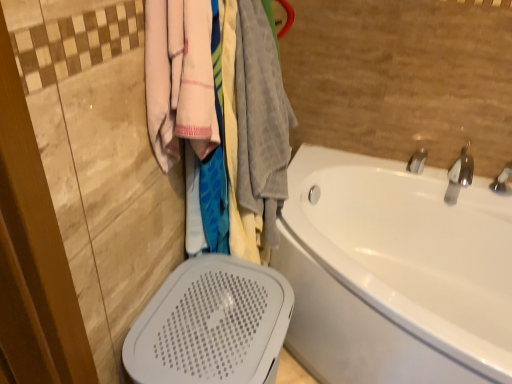
What is the approximate height of white glossy bathtub at right?

23.63 inches.

This screenshot has height=384, width=512. Describe the element at coordinates (179, 78) in the screenshot. I see `soft pink towel at upper left` at that location.

Identify the location of soft pink towel at upper left. (179, 78).

This screenshot has height=384, width=512. What do you see at coordinates (417, 161) in the screenshot? I see `silver metallic tap at upper right, which is the 2th tap from right to left` at bounding box center [417, 161].

Locate an element on the screen. This screenshot has width=512, height=384. white glossy bathtub at right is located at coordinates (395, 273).

Between soft cotton towels at upper left and silver metallic tap at upper right, which is counted as the 1th tap, starting from the left, which one appears on the left side from the viewer's perspective?

soft cotton towels at upper left is more to the left.

This screenshot has width=512, height=384. What are the coordinates of `closet in front of the silver metallic tap at upper right, which is the 2th tap from right to left` in the screenshot? It's located at (221, 118).

Relative to silver metallic tap at upper right, which is counted as the 1th tap, starting from the left, is soft cotton towels at upper left in front or behind?

soft cotton towels at upper left is in front of silver metallic tap at upper right, which is counted as the 1th tap, starting from the left.

In the scene shown: Is soft cotton towels at upper left taller than silver metallic tap at upper right, which is the 2th tap from right to left?

Yes, soft cotton towels at upper left is taller than silver metallic tap at upper right, which is the 2th tap from right to left.

Would you say white glossy bathtub at right contains soft cotton towels at upper left?

No, soft cotton towels at upper left is located outside of white glossy bathtub at right.

Is white glossy bathtub at right shorter than soft cotton towels at upper left?

Correct, white glossy bathtub at right is not as tall as soft cotton towels at upper left.

Does point (344, 356) come behind point (204, 176)?

Yes, it is.

Is white glossy bathtub at right aimed at soft cotton towels at upper left?

No, white glossy bathtub at right is not oriented towards soft cotton towels at upper left.

In terms of width, does silver metallic faucet at upper right, which ranks as the 1th tap in right-to-left order, look wider or thinner when compared to white glossy bathtub at right?

Considering their sizes, silver metallic faucet at upper right, which ranks as the 1th tap in right-to-left order, looks slimmer than white glossy bathtub at right.

Find the location of a particular element. The height and width of the screenshot is (384, 512). bathtub on the left side of silver metallic faucet at upper right, acting as the second tap starting from the left is located at coordinates (395, 273).

Can you confirm if silver metallic faucet at upper right, which ranks as the 1th tap in right-to-left order, is positioned to the left of white glossy bathtub at right?

Incorrect, silver metallic faucet at upper right, which ranks as the 1th tap in right-to-left order, is not on the left side of white glossy bathtub at right.

Is the surface of silver metallic faucet at upper right, which ranks as the 1th tap in right-to-left order, in direct contact with soft pink towel at upper left?

No, silver metallic faucet at upper right, which ranks as the 1th tap in right-to-left order, is not with soft pink towel at upper left.

From a real-world perspective, who is located lower, silver metallic faucet at upper right, acting as the second tap starting from the left, or soft pink towel at upper left?

silver metallic faucet at upper right, acting as the second tap starting from the left.

Could you measure the distance between silver metallic faucet at upper right, which ranks as the 1th tap in right-to-left order, and soft pink towel at upper left?

The distance of silver metallic faucet at upper right, which ranks as the 1th tap in right-to-left order, from soft pink towel at upper left is 3.91 feet.

Consider the image. Considering the relative sizes of silver metallic faucet at upper right, which ranks as the 1th tap in right-to-left order, and soft pink towel at upper left in the image provided, is silver metallic faucet at upper right, which ranks as the 1th tap in right-to-left order, taller than soft pink towel at upper left?

In fact, silver metallic faucet at upper right, which ranks as the 1th tap in right-to-left order, may be shorter than soft pink towel at upper left.

Consider the image. Does soft pink towel at upper left turn towards silver metallic faucet at upper right, acting as the second tap starting from the left?

No, soft pink towel at upper left is not aimed at silver metallic faucet at upper right, acting as the second tap starting from the left.

Considering the sizes of objects soft pink towel at upper left and silver metallic faucet at upper right, acting as the second tap starting from the left, in the image provided, who is smaller, soft pink towel at upper left or silver metallic faucet at upper right, acting as the second tap starting from the left,?

Smaller between the two is silver metallic faucet at upper right, acting as the second tap starting from the left.

From the image's perspective, which one is positioned higher, soft pink towel at upper left or silver metallic faucet at upper right, which ranks as the 1th tap in right-to-left order?

soft pink towel at upper left.

Which point is more forward, [152,85] or [457,172]?

Point [152,85]

Between silver metallic tap at upper right, which is counted as the 1th tap, starting from the left, and white glossy bathtub at right, which one has smaller width?

silver metallic tap at upper right, which is counted as the 1th tap, starting from the left, is thinner.

Who is shorter, silver metallic tap at upper right, which is counted as the 1th tap, starting from the left, or white glossy bathtub at right?

Standing shorter between the two is silver metallic tap at upper right, which is counted as the 1th tap, starting from the left.

Locate an element on the screen. The width and height of the screenshot is (512, 384). bathtub in front of the silver metallic tap at upper right, which is the 2th tap from right to left is located at coordinates (395, 273).

Would you say silver metallic tap at upper right, which is the 2th tap from right to left, is inside or outside soft cotton towels at upper left?

silver metallic tap at upper right, which is the 2th tap from right to left, is not enclosed by soft cotton towels at upper left.

Considering the sizes of objects silver metallic tap at upper right, which is the 2th tap from right to left, and soft cotton towels at upper left in the image provided, who is thinner, silver metallic tap at upper right, which is the 2th tap from right to left, or soft cotton towels at upper left?

silver metallic tap at upper right, which is the 2th tap from right to left, is thinner.

From the image's perspective, is silver metallic tap at upper right, which is counted as the 1th tap, starting from the left, above or below soft cotton towels at upper left?

silver metallic tap at upper right, which is counted as the 1th tap, starting from the left, is below soft cotton towels at upper left.

At what (x,y) coordinates should I click in order to perform the action: click on closet that is above the silver metallic tap at upper right, which is counted as the 1th tap, starting from the left (from a real-world perspective). Please return your answer as a coordinate pair (x, y). The height and width of the screenshot is (384, 512). Looking at the image, I should click on (221, 118).

You are a GUI agent. You are given a task and a screenshot of the screen. Output one action in this format:
    pyautogui.click(x=<x>, y=<y>)
    Task: Click on the closet in front of the white glossy bathtub at right
    
    Given the screenshot: What is the action you would take?
    pyautogui.click(x=221, y=118)

Looking at the image, which one is located closer to white glossy bathtub at right, silver metallic faucet at upper right, acting as the second tap starting from the left, or silver metallic tap at upper right, which is counted as the 1th tap, starting from the left?

silver metallic faucet at upper right, acting as the second tap starting from the left, is positioned closer to the anchor white glossy bathtub at right.

Considering their positions, is soft cotton towels at upper left positioned closer to soft pink towel at upper left than white glossy bathtub at right?

Based on the image, soft cotton towels at upper left appears to be nearer to soft pink towel at upper left.

When comparing their distances from silver metallic tap at upper right, which is counted as the 1th tap, starting from the left, does soft cotton towels at upper left or white glossy bathtub at right seem closer?

white glossy bathtub at right lies closer to silver metallic tap at upper right, which is counted as the 1th tap, starting from the left, than the other object.

Looking at the image, which one is located further to white glossy bathtub at right, silver metallic tap at upper right, which is the 2th tap from right to left, or soft pink towel at upper left?

Among the two, soft pink towel at upper left is located further to white glossy bathtub at right.

Considering their positions, is soft cotton towels at upper left positioned closer to silver metallic tap at upper right, which is counted as the 1th tap, starting from the left, than soft pink towel at upper left?

The object closer to silver metallic tap at upper right, which is counted as the 1th tap, starting from the left, is soft cotton towels at upper left.

Based on their spatial positions, is silver metallic faucet at upper right, acting as the second tap starting from the left, or white glossy bathtub at right closer to soft cotton towels at upper left?

Among the two, white glossy bathtub at right is located nearer to soft cotton towels at upper left.

When comparing their distances from silver metallic faucet at upper right, acting as the second tap starting from the left, does silver metallic tap at upper right, which is counted as the 1th tap, starting from the left, or soft pink towel at upper left seem closer?

Based on the image, silver metallic tap at upper right, which is counted as the 1th tap, starting from the left, appears to be nearer to silver metallic faucet at upper right, acting as the second tap starting from the left.

From the image, which object appears to be nearer to silver metallic tap at upper right, which is counted as the 1th tap, starting from the left, white glossy bathtub at right or silver metallic faucet at upper right, which ranks as the 1th tap in right-to-left order?

silver metallic faucet at upper right, which ranks as the 1th tap in right-to-left order, lies closer to silver metallic tap at upper right, which is counted as the 1th tap, starting from the left, than the other object.

This screenshot has height=384, width=512. Find the location of `closet between soft pink towel at upper left and silver metallic faucet at upper right, which ranks as the 1th tap in right-to-left order, from left to right`. closet between soft pink towel at upper left and silver metallic faucet at upper right, which ranks as the 1th tap in right-to-left order, from left to right is located at coordinates 221,118.

Identify the location of bathtub located between soft cotton towels at upper left and silver metallic faucet at upper right, acting as the second tap starting from the left, in the left-right direction. The height and width of the screenshot is (384, 512). (395, 273).

You are a GUI agent. You are given a task and a screenshot of the screen. Output one action in this format:
    pyautogui.click(x=<x>, y=<y>)
    Task: Click on the closet between soft pink towel at upper left and silver metallic tap at upper right, which is the 2th tap from right to left, in the front-back direction
    This screenshot has height=384, width=512.
    Given the screenshot: What is the action you would take?
    pyautogui.click(x=221, y=118)

The width and height of the screenshot is (512, 384). I want to click on bathtub between soft pink towel at upper left and silver metallic faucet at upper right, which ranks as the 1th tap in right-to-left order, in the horizontal direction, so click(395, 273).